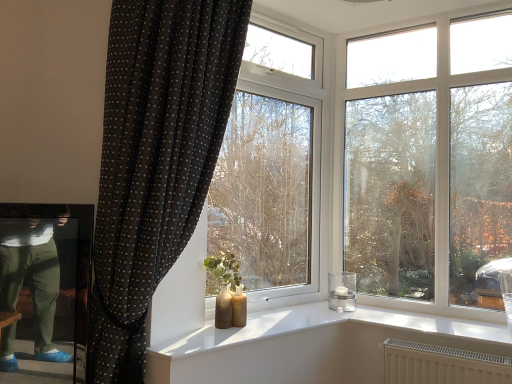
In order to face clear glass candle holder at window, should I rotate leftwards or rightwards?

Rotate right and turn 11.404 degrees.

Measure the distance between point [112,12] and camera.

The distance of point [112,12] from camera is 5.51 feet.

The image size is (512, 384). I want to click on transparent glass tree at center, so point(428,189).

Is transparent glass tree at center positioned before transparent glass window at center?

No, transparent glass tree at center is further to the viewer.

From a real-world perspective, is transparent glass tree at center positioned under transparent glass window at center based on gravity?

Actually, transparent glass tree at center is physically above transparent glass window at center in the real world.

Is transparent glass tree at center positioned with its back to transparent glass window at center?

That's not correct — transparent glass tree at center is not looking away from transparent glass window at center.

What's the angular difference between transparent glass tree at center and transparent glass window at center's facing directions?

The angular difference between transparent glass tree at center and transparent glass window at center is 68.9 degrees.

Is transparent glass tree at center spatially inside clear glass candle holder at window, or outside of it?

transparent glass tree at center cannot be found inside clear glass candle holder at window.

Does transparent glass tree at center have a greater height compared to clear glass candle holder at window?

Indeed, transparent glass tree at center has a greater height compared to clear glass candle holder at window.

Between transparent glass tree at center and clear glass candle holder at window, which one appears on the right side from the viewer's perspective?

transparent glass tree at center is more to the right.

Which object is further away from the camera, transparent glass tree at center or clear glass candle holder at window?

clear glass candle holder at window is further from the camera.

From a real-world perspective, is transparent glass window at center over clear glass candle holder at window?

Yes, from a real-world perspective, transparent glass window at center is above clear glass candle holder at window.

Is transparent glass window at center oriented towards clear glass candle holder at window?

Yes, transparent glass window at center faces towards clear glass candle holder at window.

From the image's perspective, which object appears higher, transparent glass window at center or clear glass candle holder at window?

transparent glass window at center is shown above in the image.

Would you say transparent glass window at center is part of clear glass candle holder at window's contents?

That's incorrect, transparent glass window at center is not inside clear glass candle holder at window.

Who is taller, clear glass candle holder at window or transparent glass window at center?

With more height is transparent glass window at center.

Is clear glass candle holder at window positioned before transparent glass window at center?

No, clear glass candle holder at window is further to the viewer.

Is point (330, 304) closer to viewer compared to point (293, 228)?

Yes.

Is clear glass candle holder at window in front of black dotted fabric curtain at left?

No, clear glass candle holder at window is further to the viewer.

Is clear glass candle holder at window wider than black dotted fabric curtain at left?

No.

In the scene shown: From a real-world perspective, which object stands above the other?

black dotted fabric curtain at left is physically above.

Considering the positions of points (338, 274) and (485, 144), is point (338, 274) farther from camera compared to point (485, 144)?

Yes, it is behind point (485, 144).

What's the angular difference between clear glass candle holder at window and transparent glass tree at center's facing directions?

1.99 degrees separate the facing orientations of clear glass candle holder at window and transparent glass tree at center.

Is clear glass candle holder at window spatially inside transparent glass tree at center, or outside of it?

clear glass candle holder at window lies outside transparent glass tree at center.

Which object is wider, transparent glass window at center or transparent glass tree at center?

Wider between the two is transparent glass window at center.

In the image, is transparent glass window at center positioned in front of or behind transparent glass tree at center?

Clearly, transparent glass window at center is in front of transparent glass tree at center.

Is transparent glass window at center spatially inside transparent glass tree at center, or outside of it?

transparent glass window at center is not inside transparent glass tree at center, it's outside.

Is transparent glass window at center in contact with transparent glass tree at center?

transparent glass window at center is not next to transparent glass tree at center, and they're not touching.

Identify the location of tree that is behind the transparent glass window at center. (x=428, y=189).

The height and width of the screenshot is (384, 512). What are the coordinates of `candle holder on the left of transparent glass tree at center` in the screenshot? It's located at (342, 291).

Estimate the real-world distances between objects in this image. Which object is closer to black dotted fabric curtain at left, transparent glass window at center or clear glass candle holder at window?

The object closer to black dotted fabric curtain at left is transparent glass window at center.

Based on their spatial positions, is black dotted fabric curtain at left or transparent glass window at center further from transparent glass tree at center?

black dotted fabric curtain at left is further to transparent glass tree at center.

Looking at the image, which one is located further to black dotted fabric curtain at left, clear glass candle holder at window or transparent glass window at center?

Based on the image, clear glass candle holder at window appears to be further to black dotted fabric curtain at left.

Estimate the real-world distances between objects in this image. Which object is further from transparent glass tree at center, transparent glass window at center or black dotted fabric curtain at left?

Based on the image, black dotted fabric curtain at left appears to be further to transparent glass tree at center.

From the image, which object appears to be farther from transparent glass window at center, black dotted fabric curtain at left or transparent glass tree at center?

black dotted fabric curtain at left lies further to transparent glass window at center than the other object.

When comparing their distances from black dotted fabric curtain at left, does transparent glass window at center or transparent glass tree at center seem closer?

transparent glass window at center is closer to black dotted fabric curtain at left.

Based on their spatial positions, is transparent glass window at center or clear glass candle holder at window further from transparent glass tree at center?

The object further to transparent glass tree at center is transparent glass window at center.

From the image, which object appears to be farther from black dotted fabric curtain at left, transparent glass tree at center or clear glass candle holder at window?

Among the two, clear glass candle holder at window is located further to black dotted fabric curtain at left.

Identify the location of candle holder situated between black dotted fabric curtain at left and transparent glass tree at center from left to right. (342, 291).

Image resolution: width=512 pixels, height=384 pixels. Identify the location of window between black dotted fabric curtain at left and clear glass candle holder at window from front to back. (272, 164).

Locate an element on the screen. The image size is (512, 384). tree between transparent glass window at center and clear glass candle holder at window from top to bottom is located at coordinates (428, 189).

I want to click on window between black dotted fabric curtain at left and transparent glass tree at center from left to right, so click(272, 164).